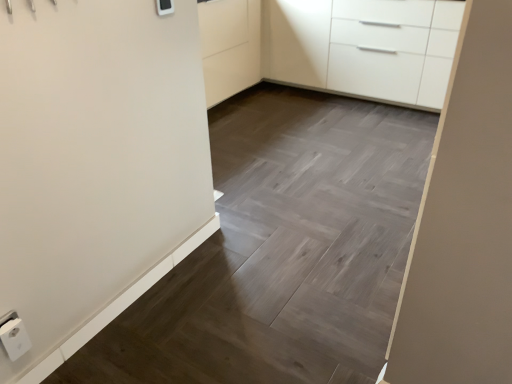
Question: Is white plastic light switch at upper center at the left side of white plastic electric outlet at lower left?

Choices:
 (A) yes
 (B) no

Answer: (B)

Question: Is the position of white plastic light switch at upper center less distant than that of white plastic electric outlet at lower left?

Choices:
 (A) no
 (B) yes

Answer: (A)

Question: From a real-world perspective, is white plastic light switch at upper center on white plastic electric outlet at lower left?

Choices:
 (A) no
 (B) yes

Answer: (B)

Question: Would you say white plastic light switch at upper center contains white plastic electric outlet at lower left?

Choices:
 (A) yes
 (B) no

Answer: (B)

Question: Is white plastic light switch at upper center positioned behind white plastic electric outlet at lower left?

Choices:
 (A) no
 (B) yes

Answer: (B)

Question: Looking at their shapes, would you say white plastic light switch at upper center is wider or thinner than white glossy cabinet at upper right?

Choices:
 (A) thin
 (B) wide

Answer: (A)

Question: Visually, is white plastic light switch at upper center positioned to the left or to the right of white glossy cabinet at upper right?

Choices:
 (A) left
 (B) right

Answer: (A)

Question: From a real-world perspective, is white plastic light switch at upper center physically located above or below white glossy cabinet at upper right?

Choices:
 (A) above
 (B) below

Answer: (A)

Question: Considering the positions of white plastic light switch at upper center and white glossy cabinet at upper right in the image, is white plastic light switch at upper center bigger or smaller than white glossy cabinet at upper right?

Choices:
 (A) small
 (B) big

Answer: (A)

Question: From the image's perspective, relative to white plastic electric outlet at lower left, is white plastic light switch at upper center above or below?

Choices:
 (A) above
 (B) below

Answer: (A)

Question: Is white plastic light switch at upper center inside the boundaries of white plastic electric outlet at lower left, or outside?

Choices:
 (A) inside
 (B) outside

Answer: (B)

Question: In terms of size, does white plastic light switch at upper center appear bigger or smaller than white plastic electric outlet at lower left?

Choices:
 (A) small
 (B) big

Answer: (A)

Question: In terms of width, does white plastic light switch at upper center look wider or thinner when compared to white plastic electric outlet at lower left?

Choices:
 (A) wide
 (B) thin

Answer: (B)

Question: In terms of width, does white glossy cabinet at upper right look wider or thinner when compared to white plastic electric outlet at lower left?

Choices:
 (A) thin
 (B) wide

Answer: (B)

Question: In terms of height, does white glossy cabinet at upper right look taller or shorter compared to white plastic electric outlet at lower left?

Choices:
 (A) short
 (B) tall

Answer: (B)